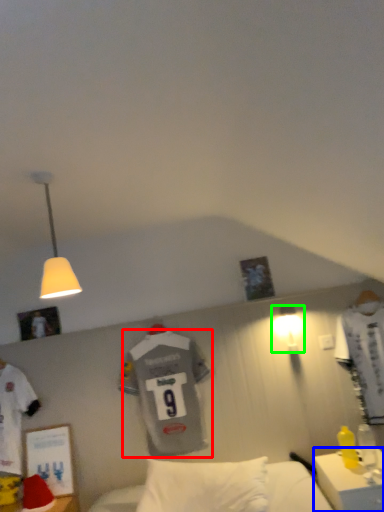
Question: Which object is the farthest from t shirt (highlighted by a red box)? Choose among these: desk (highlighted by a blue box) or lamp (highlighted by a green box).

Choices:
 (A) desk
 (B) lamp

Answer: (A)